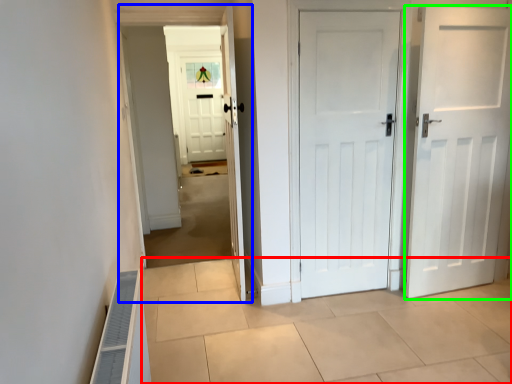
Question: Which object is positioned closest to path (highlighted by a red box)? Select from corridor (highlighted by a blue box) and door (highlighted by a green box).

Choices:
 (A) corridor
 (B) door

Answer: (B)